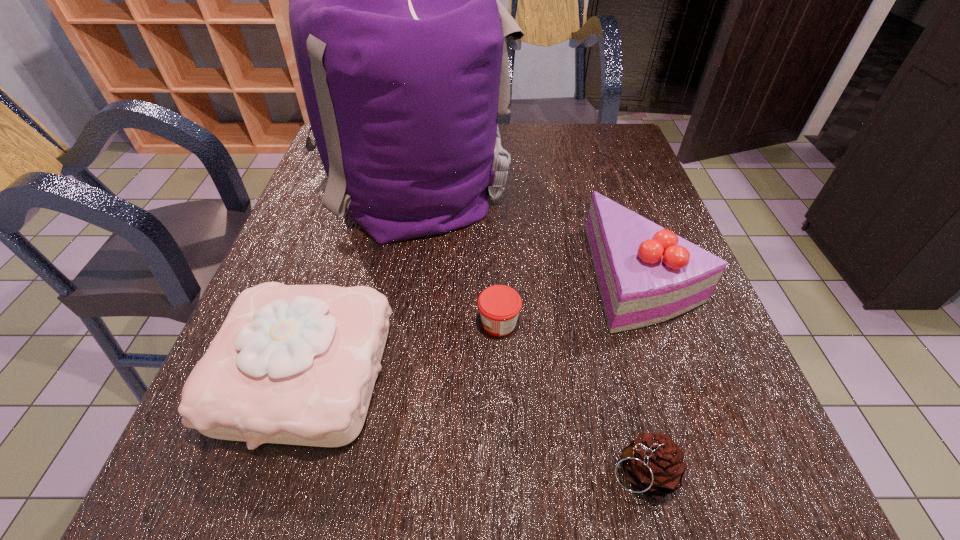
I want to click on cake situated at the right edge, so click(x=646, y=274).

The width and height of the screenshot is (960, 540). I want to click on pinecone present at the right edge, so click(654, 464).

Locate an element on the screen. object that is at the far left corner is located at coordinates (401, 43).

You are a GUI agent. You are given a task and a screenshot of the screen. Output one action in this format:
    pyautogui.click(x=<x>, y=<y>)
    Task: Click on the object that is positioned at the near right corner
    The image size is (960, 540).
    Given the screenshot: What is the action you would take?
    point(654,464)

Locate an element on the screen. The image size is (960, 540). free space at the far edge of the desktop is located at coordinates (540, 164).

This screenshot has width=960, height=540. What are the coordinates of `vacant space at the near edge of the desktop` in the screenshot? It's located at (611, 516).

The width and height of the screenshot is (960, 540). In order to click on free space at the left edge of the desktop in this screenshot , I will do `click(340, 242)`.

The image size is (960, 540). In the image, there is a desktop. What are the coordinates of `vacant region at the right edge` in the screenshot? It's located at (661, 420).

In the image, there is a desktop. Find the location of `free space at the far right corner`. free space at the far right corner is located at coordinates (591, 154).

The height and width of the screenshot is (540, 960). Find the location of `vacant space that is in between the jam and the fourth shortest object`. vacant space that is in between the jam and the fourth shortest object is located at coordinates (571, 300).